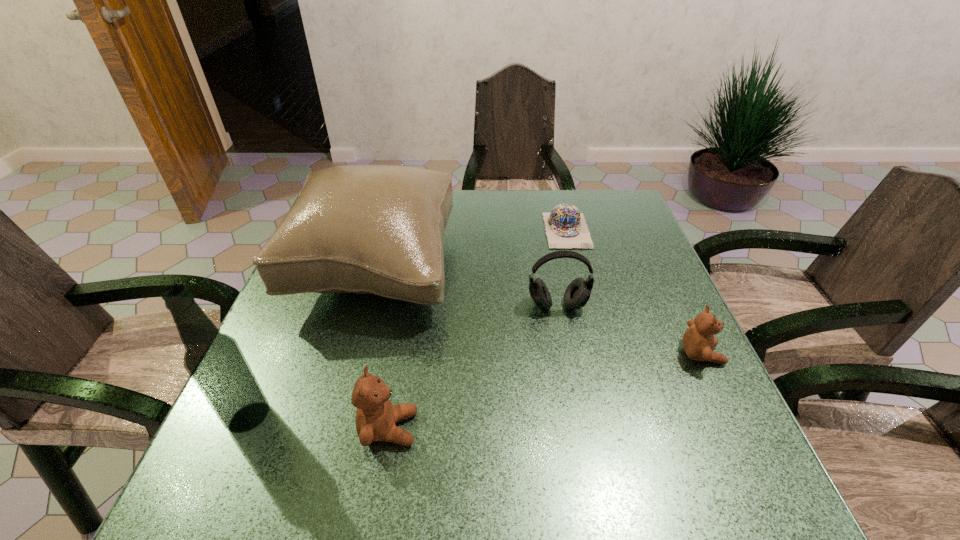
Find the location of a particular element. This screenshot has height=540, width=960. vacant area that lies between the nearer teddy bear and the rightmost object is located at coordinates (545, 392).

Find the location of a particular element. free spot between the tallest object and the headset is located at coordinates (403, 361).

This screenshot has height=540, width=960. I want to click on vacant area that lies between the headset and the cushion, so click(x=467, y=287).

Where is `vacant area that lies between the tallest object and the nearer teddy bear`? The height and width of the screenshot is (540, 960). vacant area that lies between the tallest object and the nearer teddy bear is located at coordinates (319, 423).

Identify the location of free point between the shortest object and the headset. (562, 268).

Where is `empty space that is in between the alcohol and the fifth shortest object`? This screenshot has height=540, width=960. empty space that is in between the alcohol and the fifth shortest object is located at coordinates (312, 343).

Identify the location of unoccupied area between the fifth shortest object and the cap. This screenshot has height=540, width=960. (471, 250).

The height and width of the screenshot is (540, 960). What are the coordinates of `free space between the cushion and the tallest object` in the screenshot? It's located at (312, 343).

Identify the location of blank region between the alcohol and the cap. Image resolution: width=960 pixels, height=540 pixels. (408, 323).

Identify which object is the closest to the fifth shortest object. Please provide its 2D coordinates. Your answer should be formatted as a tuple, i.e. [(x, y)], where the tuple contains the x and y coordinates of a point satisfying the conditions above.

[(215, 362)]